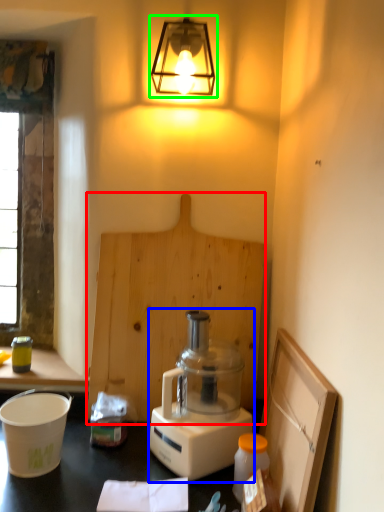
Question: Considering the real-world distances, which object is closest to plywood (highlighted by a red box)? blender (highlighted by a blue box) or lamp (highlighted by a green box).

Choices:
 (A) blender
 (B) lamp

Answer: (A)